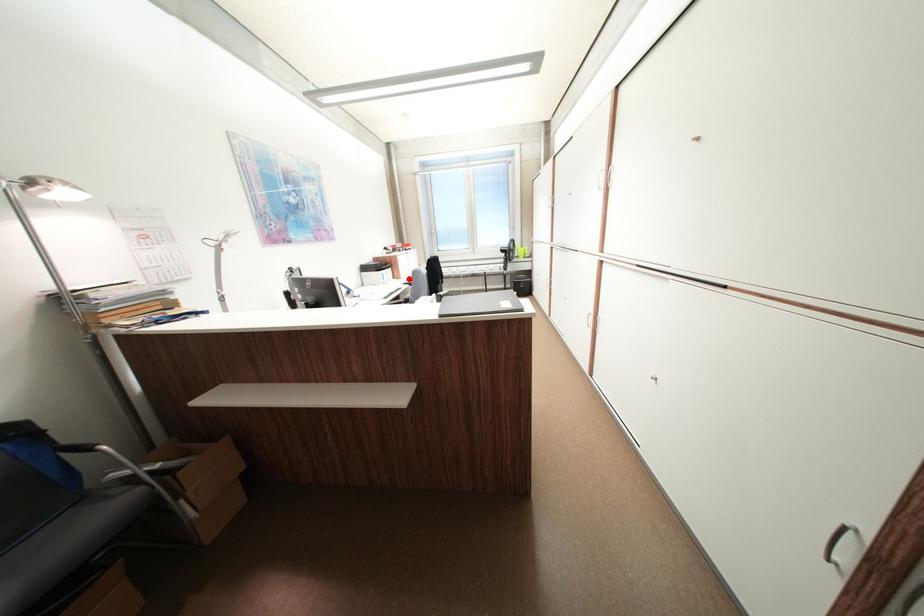
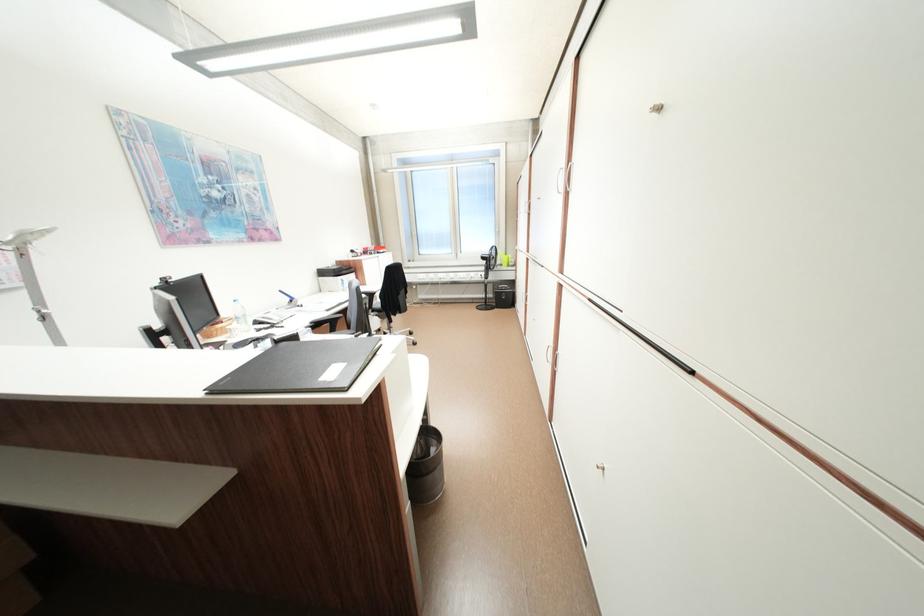
In the second image, find the point that corresponds to the highlighted location in the first image.

(373, 285)